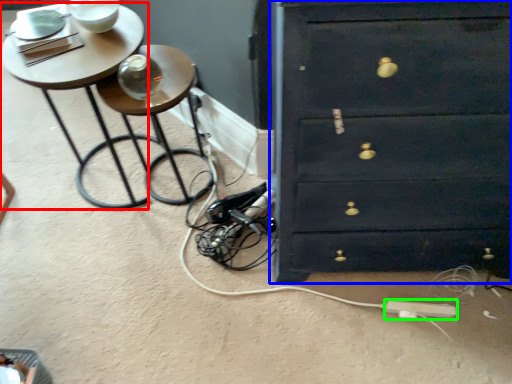
Question: Considering the real-world distances, which object is farthest from table (highlighted by a red box)? chest of drawers (highlighted by a blue box) or extension cord (highlighted by a green box)?

Choices:
 (A) chest of drawers
 (B) extension cord

Answer: (B)